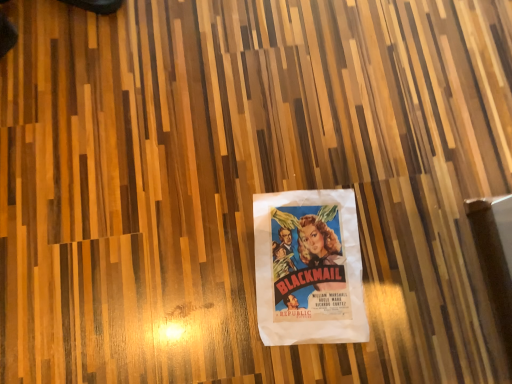
Looking at this image, what is the approximate height of white paper poster at center?

It is 1.16 inches.

Describe the element at coordinates (308, 268) in the screenshot. The image size is (512, 384). I see `white paper poster at center` at that location.

The height and width of the screenshot is (384, 512). In order to click on white paper poster at center in this screenshot , I will do `click(308, 268)`.

I want to click on black leather shoe at upper left, so point(96,5).

Describe the element at coordinates (96, 5) in the screenshot. I see `black leather shoe at upper left` at that location.

Locate an element on the screen. This screenshot has width=512, height=384. white paper poster at center is located at coordinates (308, 268).

Does white paper poster at center appear on the right side of black leather shoe at upper left?

Indeed, white paper poster at center is positioned on the right side of black leather shoe at upper left.

Is white paper poster at center positioned before black leather shoe at upper left?

Yes, it is.

Which is closer to the camera, (344, 297) or (110, 11)?

Point (344, 297).

From the image's perspective, is white paper poster at center located above or below black leather shoe at upper left?

white paper poster at center is below black leather shoe at upper left.

From a real-world perspective, which is physically above, white paper poster at center or black leather shoe at upper left?

From a 3D spatial view, black leather shoe at upper left is above.

Looking at their sizes, would you say white paper poster at center is wider or thinner than black leather shoe at upper left?

white paper poster at center is wider than black leather shoe at upper left.

Considering the relative sizes of white paper poster at center and black leather shoe at upper left in the image provided, is white paper poster at center shorter than black leather shoe at upper left?

Yes.

Between white paper poster at center and black leather shoe at upper left, which one has smaller size?

white paper poster at center.

Is white paper poster at center surrounding black leather shoe at upper left?

Actually, black leather shoe at upper left is outside white paper poster at center.

Is there a large distance between white paper poster at center and black leather shoe at upper left?

No, white paper poster at center is not far from black leather shoe at upper left.

Is white paper poster at center aimed at black leather shoe at upper left?

No, white paper poster at center is not oriented towards black leather shoe at upper left.

What's the angular difference between white paper poster at center and black leather shoe at upper left's facing directions?

There is a 117-degree angle between the facing directions of white paper poster at center and black leather shoe at upper left.

This screenshot has width=512, height=384. In order to click on shoe that is behind the white paper poster at center in this screenshot , I will do `click(96, 5)`.

Considering the positions of objects black leather shoe at upper left and white paper poster at center in the image provided, who is more to the right, black leather shoe at upper left or white paper poster at center?

Positioned to the right is white paper poster at center.

Based on the photo, which object is further away from the camera, black leather shoe at upper left or white paper poster at center?

black leather shoe at upper left is behind.

Is point (95, 0) behind point (348, 308)?

Yes.

From the image's perspective, which one is positioned lower, black leather shoe at upper left or white paper poster at center?

white paper poster at center.

From a real-world perspective, who is located lower, black leather shoe at upper left or white paper poster at center?

white paper poster at center.

Consider the image. Can you confirm if black leather shoe at upper left is thinner than white paper poster at center?

Yes, black leather shoe at upper left is thinner than white paper poster at center.

Between black leather shoe at upper left and white paper poster at center, which one has less height?

white paper poster at center.

Based on their sizes in the image, would you say black leather shoe at upper left is bigger or smaller than white paper poster at center?

black leather shoe at upper left is bigger than white paper poster at center.

Does black leather shoe at upper left contain white paper poster at center?

That's incorrect, white paper poster at center is not inside black leather shoe at upper left.

Is black leather shoe at upper left next to white paper poster at center?

No.

Is white paper poster at center at the back of black leather shoe at upper left?

That's not correct — black leather shoe at upper left is not looking away from white paper poster at center.

What's the angular difference between black leather shoe at upper left and white paper poster at center's facing directions?

The angle between the facing direction of black leather shoe at upper left and the facing direction of white paper poster at center is 117 degrees.

This screenshot has height=384, width=512. In order to click on shoe that is behind the white paper poster at center in this screenshot , I will do `click(96, 5)`.

Find the location of a particular element. shoe behind the white paper poster at center is located at coordinates (96, 5).

Locate an element on the screen. This screenshot has width=512, height=384. shoe positioned vertically above the white paper poster at center (from a real-world perspective) is located at coordinates (96, 5).